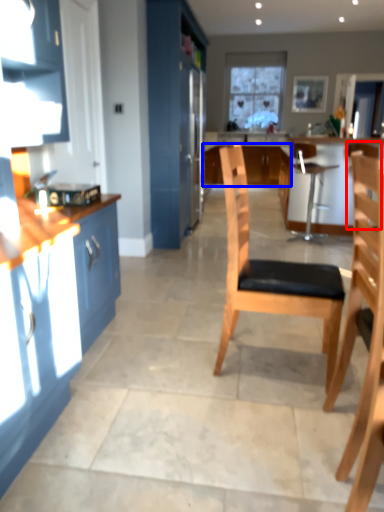
Question: Which object appears closest to the camera in this image, armchair (highlighted by a red box) or cabinetry (highlighted by a blue box)?

Choices:
 (A) armchair
 (B) cabinetry

Answer: (A)